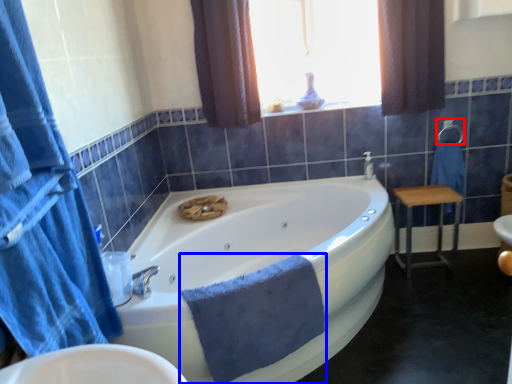
Question: Which point is further to the camera, towel bar (highlighted by a red box) or bath towel (highlighted by a blue box)?

Choices:
 (A) towel bar
 (B) bath towel

Answer: (A)